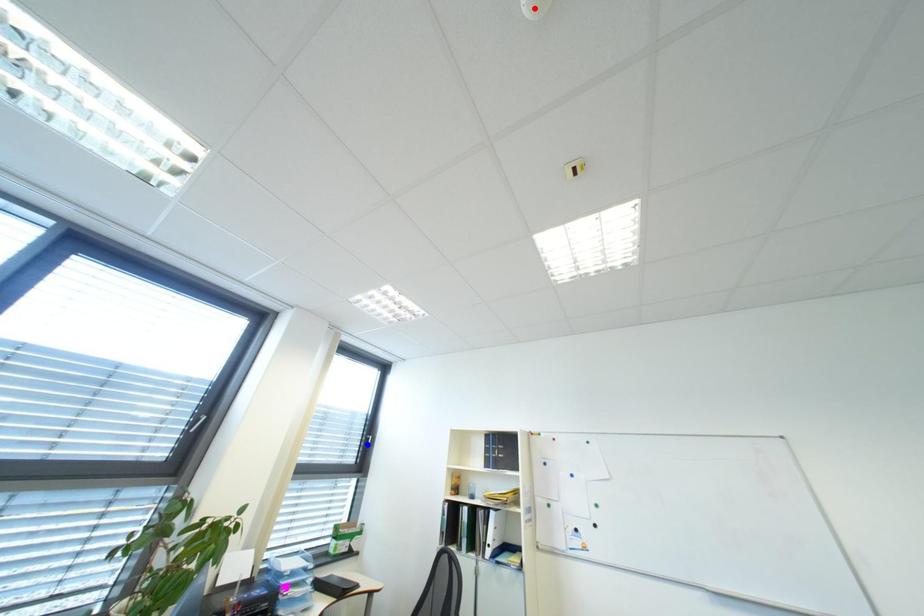
Question: Which of the two points in the image is closer to the camera?

Choices:
 (A) Blue point is closer.
 (B) Red point is closer.

Answer: (B)